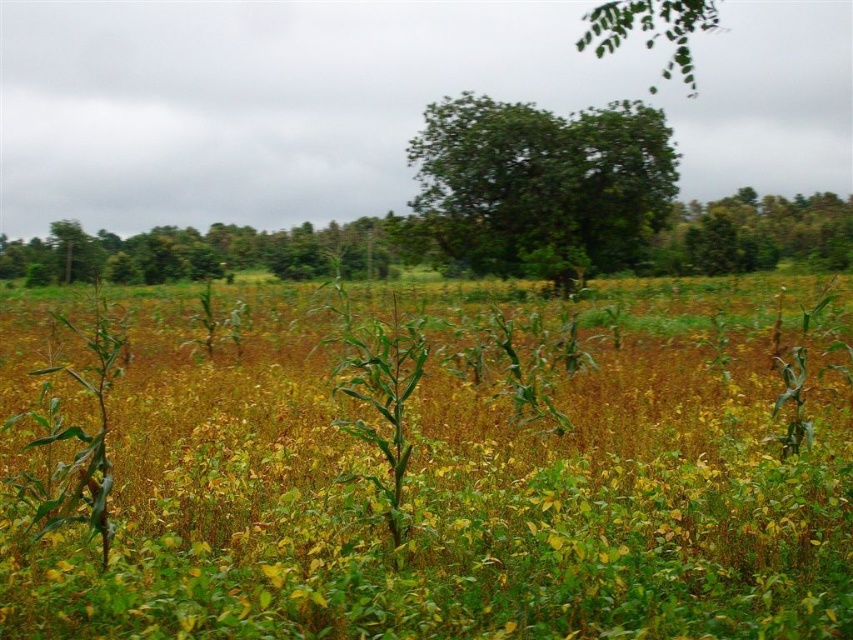
Who is more forward, (488, 531) or (579, 212)?

Point (488, 531)

Is green grass at center to the left of green leafy tree at center from the viewer's perspective?

Correct, you'll find green grass at center to the left of green leafy tree at center.

Measure the distance between point (199, 538) and camera.

Point (199, 538) and camera are 18.91 feet apart.

The image size is (853, 640). What are the coordinates of `green grass at center` in the screenshot? It's located at (428, 483).

Who is positioned more to the right, green grass at center or green leafy tree at left?

green grass at center is more to the right.

Where is `green grass at center`? The image size is (853, 640). green grass at center is located at coordinates (428, 483).

Is point (726, 346) positioned in front of point (407, 228)?

Yes.

This screenshot has height=640, width=853. What are the coordinates of `green grass at center` in the screenshot? It's located at (428, 483).

Between point (560, 145) and point (125, 257), which one is positioned behind?

The point (125, 257) is more distant.

Does green leafy tree at center appear under green leafy tree at left?

No, green leafy tree at center is not below green leafy tree at left.

This screenshot has width=853, height=640. Find the location of `green leafy tree at center`. green leafy tree at center is located at coordinates (543, 186).